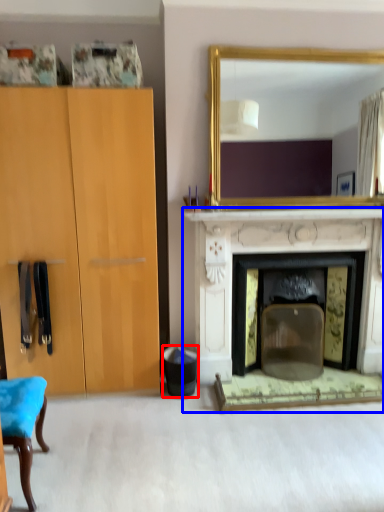
Question: Which object appears farthest to the camera in this image, trash bin/can (highlighted by a red box) or fireplace (highlighted by a blue box)?

Choices:
 (A) trash bin/can
 (B) fireplace

Answer: (A)